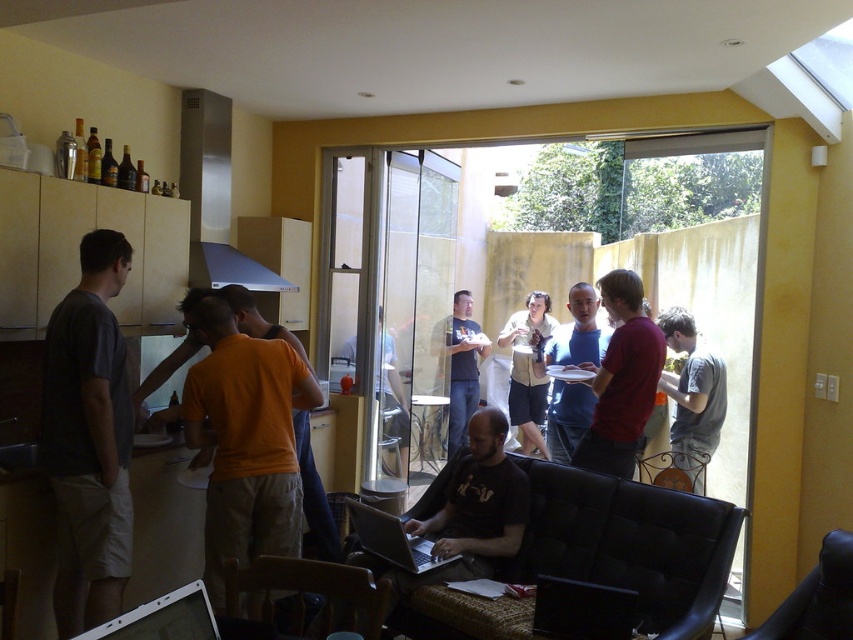
Between matte orange shirt at center and light beige shorts at center, which one has more height?

light beige shorts at center

Between point (589, 285) and point (537, 424), which one is positioned behind?

The point (537, 424) is behind.

The height and width of the screenshot is (640, 853). Describe the element at coordinates (579, 332) in the screenshot. I see `matte orange shirt at center` at that location.

Locate an element on the screen. The width and height of the screenshot is (853, 640). matte orange shirt at center is located at coordinates (579, 332).

Is orange cotton shirt at center to the left of matte red shirt at center from the viewer's perspective?

Correct, you'll find orange cotton shirt at center to the left of matte red shirt at center.

Is orange cotton shirt at center smaller than matte red shirt at center?

Actually, orange cotton shirt at center might be larger than matte red shirt at center.

Who is more distant from viewer, (257,424) or (630,410)?

The point (630,410) is behind.

The height and width of the screenshot is (640, 853). Identify the location of orange cotton shirt at center. (245, 440).

Can you confirm if gray cotton shirt at center is bigger than matte black shirt at center?

Actually, gray cotton shirt at center might be smaller than matte black shirt at center.

What do you see at coordinates (692, 396) in the screenshot? I see `gray cotton shirt at center` at bounding box center [692, 396].

This screenshot has width=853, height=640. Identify the location of gray cotton shirt at center. (692, 396).

You are a GUI agent. You are given a task and a screenshot of the screen. Output one action in this format:
    pyautogui.click(x=<x>, y=<y>)
    Task: Click on the gray cotton shirt at center
    The width and height of the screenshot is (853, 640).
    Given the screenshot: What is the action you would take?
    pyautogui.click(x=692, y=396)